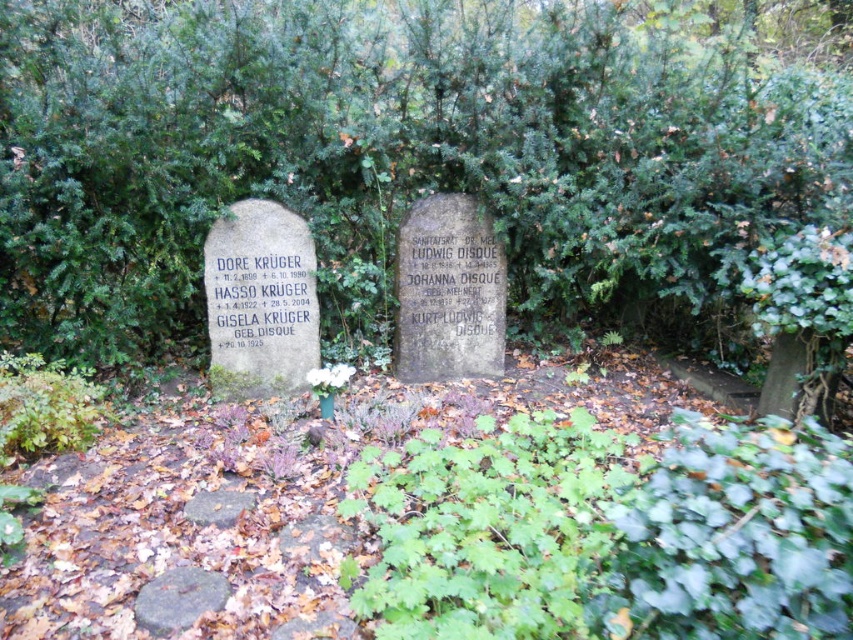
You are standing in the cemetery and want to place a flower at the base of the green leafy tree at center and the green stone at lower left. Which object should you approach first based on their positions?

You should approach the green leafy tree at center first because it is closer to you than the green stone at lower left, which is further away.

You are standing at the entrance of the cemetery and want to place a bouquet of flowers between the green leafy tree at center and the green stone at lower left. Based on their positions, where should you place the bouquet to ensure it is between them?

The green leafy tree at center is positioned over the green stone at lower left, so placing the bouquet directly below the tree and above the stone would position it between them.

You are standing in the cemetery and want to place a wreath exactly at the center of the smooth gray stone marked by point (x=260, y=300). Can you confirm if this point is indeed the center of the smooth gray stone?

Yes, the point (x=260, y=300) is indeed the center of the smooth gray stone as stated in the description.